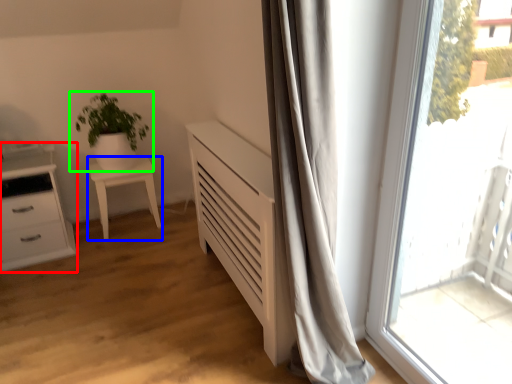
Question: Based on their relative distances, which object is nearer to chest of drawers (highlighted by a red box)? Choose from furniture (highlighted by a blue box) and houseplant (highlighted by a green box).

Choices:
 (A) furniture
 (B) houseplant

Answer: (A)